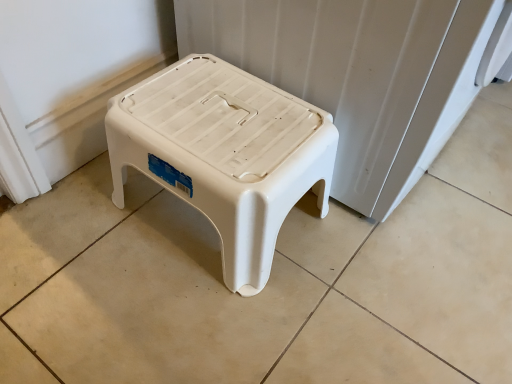
I want to click on vacant region to the left of white plastic stool at center, so click(76, 238).